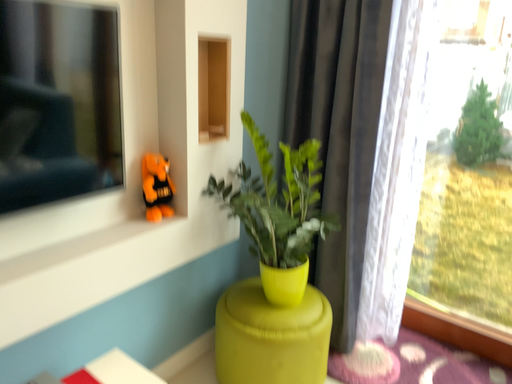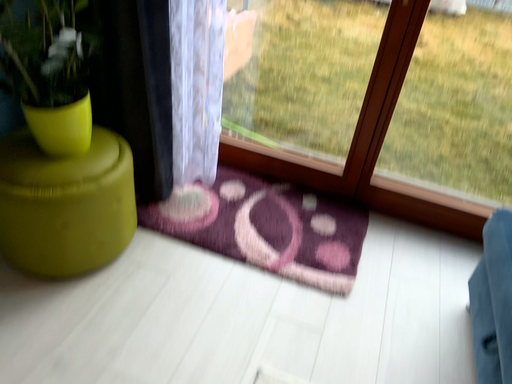
Question: Which way did the camera rotate in the video?

Choices:
 (A) rotated upward
 (B) rotated downward

Answer: (B)